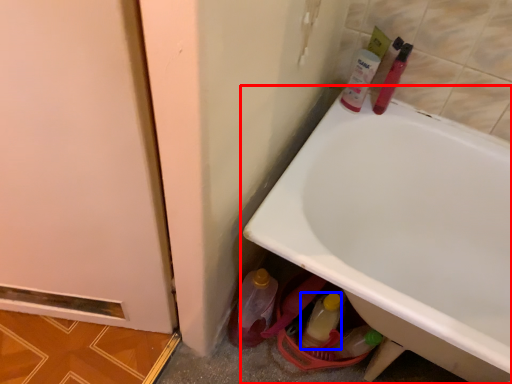
Question: Which point is further to the camera, bathtub (highlighted by a red box) or bottle (highlighted by a blue box)?

Choices:
 (A) bathtub
 (B) bottle

Answer: (B)